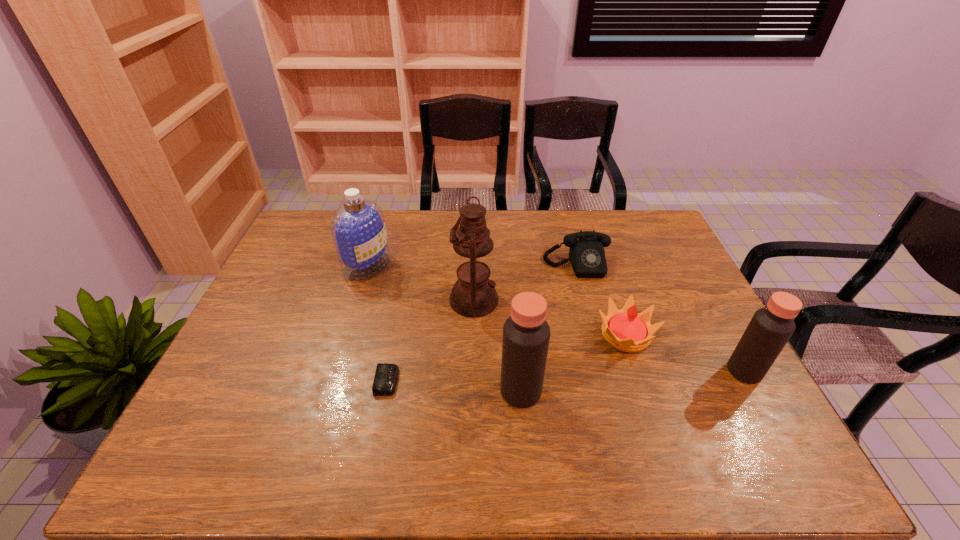
Where is `vacant space at the near edge of the desktop`? The image size is (960, 540). vacant space at the near edge of the desktop is located at coordinates pos(357,422).

Find the location of a particular element. The width and height of the screenshot is (960, 540). free location at the left edge is located at coordinates (280, 307).

In the image, there is a desktop. Identify the location of free space at the right edge. The image size is (960, 540). (664, 328).

What are the coordinates of `vacant space at the near left corner of the desktop` in the screenshot? It's located at (248, 420).

Identify the location of free point between the oil lamp and the sixth tallest object. (525, 282).

Where is `vacant area that lies between the shorter vinegar and the left vinegar`? This screenshot has width=960, height=540. vacant area that lies between the shorter vinegar and the left vinegar is located at coordinates (633, 381).

The image size is (960, 540). In order to click on free space between the fifth tallest object and the telephone in this screenshot , I will do `click(601, 300)`.

The width and height of the screenshot is (960, 540). I want to click on empty space between the sixth tallest object and the fifth tallest object, so click(x=601, y=300).

Locate an element on the screen. The height and width of the screenshot is (540, 960). free spot between the taller vinegar and the shorter vinegar is located at coordinates (633, 381).

You are a GUI agent. You are given a task and a screenshot of the screen. Output one action in this format:
    pyautogui.click(x=<x>, y=<y>)
    Task: Click on the empty space that is in between the sixth object from right to left and the cleansing agent
    
    Given the screenshot: What is the action you would take?
    pyautogui.click(x=377, y=323)